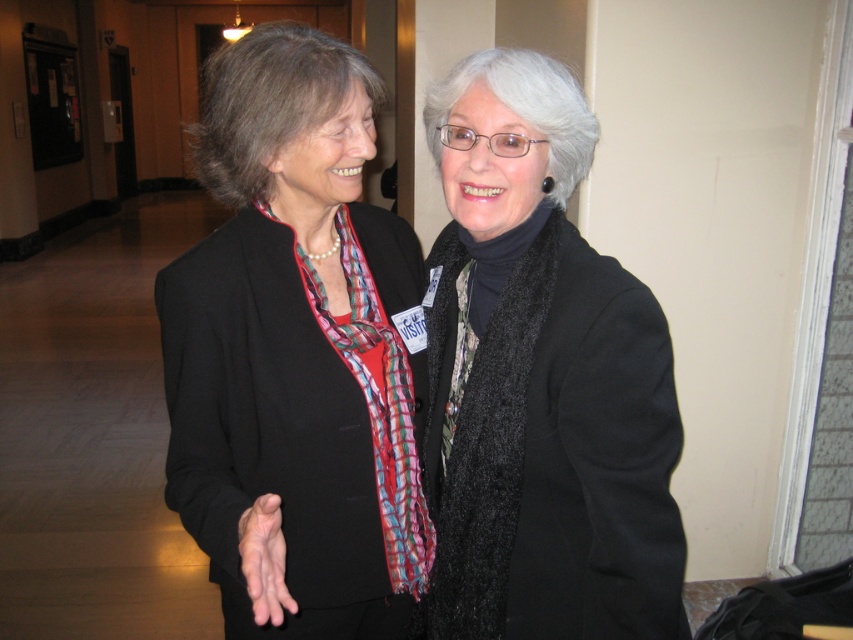
Which is below, matte black blazer at center or black fuzzy scarf at center?

Positioned lower is black fuzzy scarf at center.

Does matte black blazer at center have a lesser width compared to black fuzzy scarf at center?

No, matte black blazer at center is not thinner than black fuzzy scarf at center.

The image size is (853, 640). Describe the element at coordinates (294, 353) in the screenshot. I see `matte black blazer at center` at that location.

Find the location of `matte black blazer at center`. matte black blazer at center is located at coordinates (294, 353).